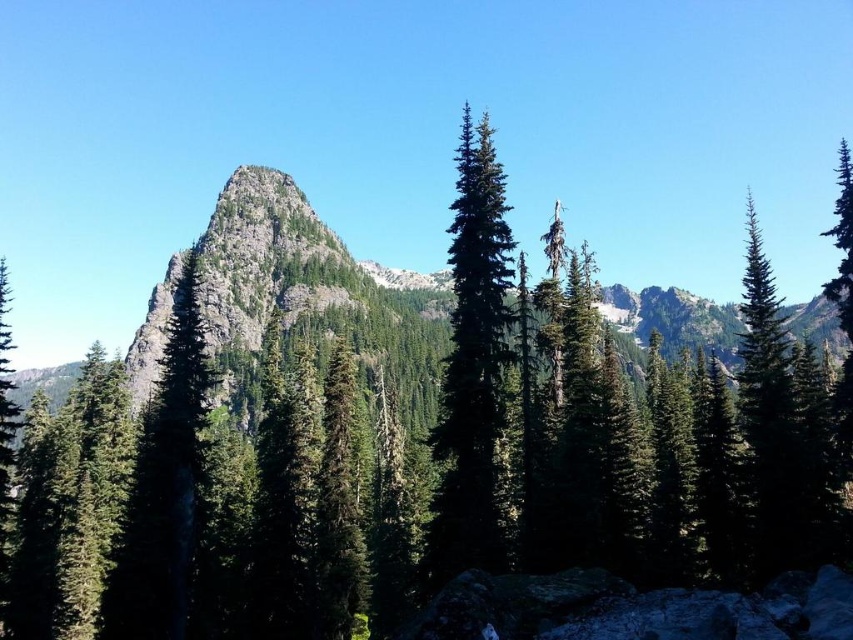
From the picture: You are an environmental scientist studying the distribution of tree species in this mountain landscape. You observe the green matte tree at center and the green textured tree at right. Which tree is located to the right of the other?

The green textured tree at right is located to the right of the green matte tree at center.

You are a hiker planning to take a photo of both the green matte tree at left and the green textured tree at right. Which tree should you move closer to in order to capture both trees in the same frame without zooming?

You should move closer to the green matte tree at left because it is smaller than the green textured tree at right, allowing both to fit within the frame when positioned nearer to the smaller tree.